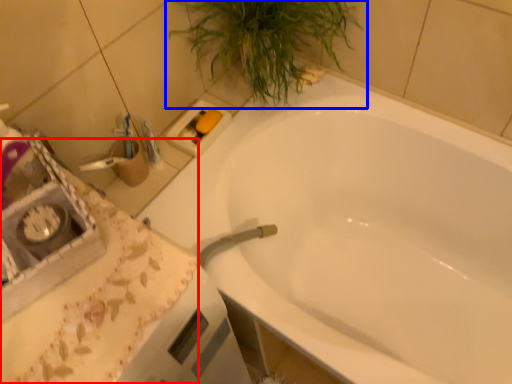
Question: Among these objects, which one is farthest to the camera, counter top (highlighted by a red box) or houseplant (highlighted by a blue box)?

Choices:
 (A) counter top
 (B) houseplant

Answer: (B)